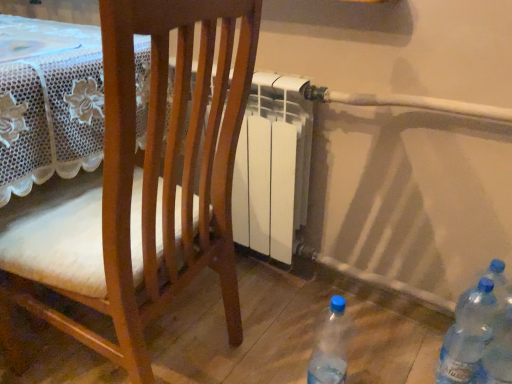
Question: Is transparent plastic bottles at lower right, placed as the 2th bottle when sorted from right to left, further to camera compared to transparent plastic bottle at lower right, marked as the first bottle in a left-to-right arrangement?

Choices:
 (A) yes
 (B) no

Answer: (A)

Question: Is transparent plastic bottles at lower right, placed as the second bottle when sorted from left to right, at the right side of transparent plastic bottle at lower right, marked as the first bottle in a left-to-right arrangement?

Choices:
 (A) yes
 (B) no

Answer: (A)

Question: From the image's perspective, would you say transparent plastic bottles at lower right, placed as the 2th bottle when sorted from right to left, is shown under transparent plastic bottle at lower right, marked as the first bottle in a left-to-right arrangement?

Choices:
 (A) yes
 (B) no

Answer: (B)

Question: Is transparent plastic bottles at lower right, placed as the second bottle when sorted from left to right, beside transparent plastic bottle at lower right, marked as the first bottle in a left-to-right arrangement?

Choices:
 (A) no
 (B) yes

Answer: (A)

Question: Considering the relative sizes of transparent plastic bottles at lower right, placed as the 2th bottle when sorted from right to left, and transparent plastic bottle at lower right, which appears as the 3th bottle when viewed from the right, in the image provided, is transparent plastic bottles at lower right, placed as the 2th bottle when sorted from right to left, smaller than transparent plastic bottle at lower right, which appears as the 3th bottle when viewed from the right,?

Choices:
 (A) no
 (B) yes

Answer: (B)

Question: From a real-world perspective, is transparent plastic bottles at lower right, placed as the 2th bottle when sorted from right to left, positioned under transparent plastic bottle at lower right, marked as the first bottle in a left-to-right arrangement, based on gravity?

Choices:
 (A) yes
 (B) no

Answer: (B)

Question: From the image's perspective, is transparent plastic bottles at lower right, placed as the second bottle when sorted from left to right, located above wooden chair at center?

Choices:
 (A) no
 (B) yes

Answer: (A)

Question: Considering the relative sizes of transparent plastic bottles at lower right, placed as the 2th bottle when sorted from right to left, and wooden chair at center in the image provided, is transparent plastic bottles at lower right, placed as the 2th bottle when sorted from right to left, taller than wooden chair at center?

Choices:
 (A) no
 (B) yes

Answer: (A)

Question: Is transparent plastic bottles at lower right, placed as the 2th bottle when sorted from right to left, to the left of wooden chair at center from the viewer's perspective?

Choices:
 (A) no
 (B) yes

Answer: (A)

Question: Is transparent plastic bottles at lower right, placed as the 2th bottle when sorted from right to left, not within wooden chair at center?

Choices:
 (A) yes
 (B) no

Answer: (A)

Question: Is transparent plastic bottles at lower right, placed as the second bottle when sorted from left to right, oriented towards wooden chair at center?

Choices:
 (A) yes
 (B) no

Answer: (B)

Question: From the image's perspective, is transparent plastic bottles at lower right, placed as the 2th bottle when sorted from right to left, below wooden chair at center?

Choices:
 (A) yes
 (B) no

Answer: (A)

Question: Is wooden chair at center looking in the opposite direction of transparent plastic bottles at lower right, placed as the second bottle when sorted from left to right?

Choices:
 (A) yes
 (B) no

Answer: (A)